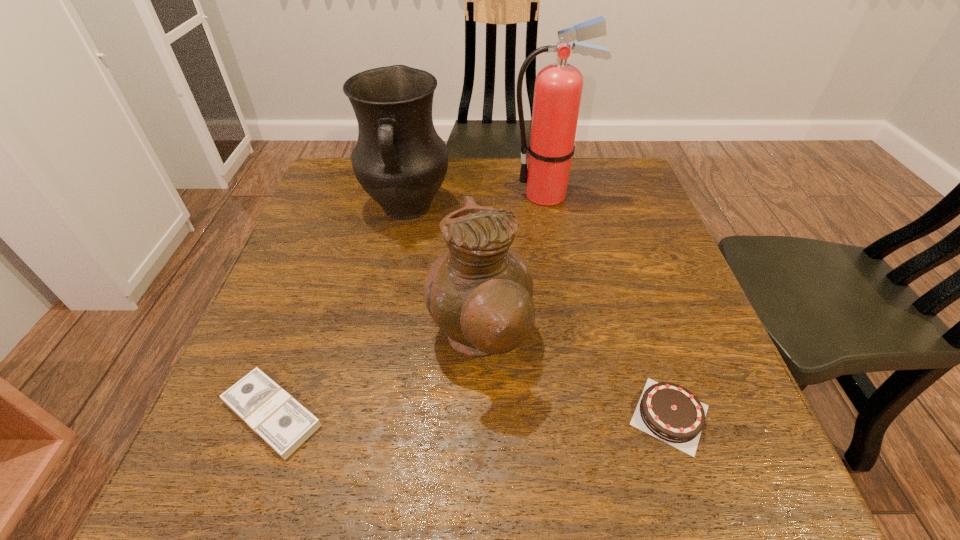
The image size is (960, 540). In order to click on free location located 0.140m on the back of the chocolate cake in this screenshot , I will do `click(637, 318)`.

Identify the location of vacant space positioned on the back of the shortest object. (335, 237).

You are a GUI agent. You are given a task and a screenshot of the screen. Output one action in this format:
    pyautogui.click(x=<x>, y=<y>)
    Task: Click on the fire extinguisher located at the far edge
    
    Given the screenshot: What is the action you would take?
    pyautogui.click(x=558, y=89)

At what (x,y) coordinates should I click in order to perform the action: click on pitcher positioned at the far edge. Please return your answer as a coordinate pair (x, y). This screenshot has width=960, height=540. Looking at the image, I should click on (399, 159).

You are a GUI agent. You are given a task and a screenshot of the screen. Output one action in this format:
    pyautogui.click(x=<x>, y=<y>)
    Task: Click on the chocolate cake at the near edge
    This screenshot has height=540, width=960.
    Given the screenshot: What is the action you would take?
    pyautogui.click(x=667, y=411)

Find the location of a particular element. dollar located at the near edge is located at coordinates (283, 423).

This screenshot has width=960, height=540. What are the coordinates of `pitcher present at the left edge` in the screenshot? It's located at (399, 159).

Locate an element on the screen. The image size is (960, 540). dollar positioned at the left edge is located at coordinates (283, 423).

Where is `object that is positioned at the right edge`? object that is positioned at the right edge is located at coordinates (667, 411).

Find the location of `object that is at the far left corner`. object that is at the far left corner is located at coordinates (399, 159).